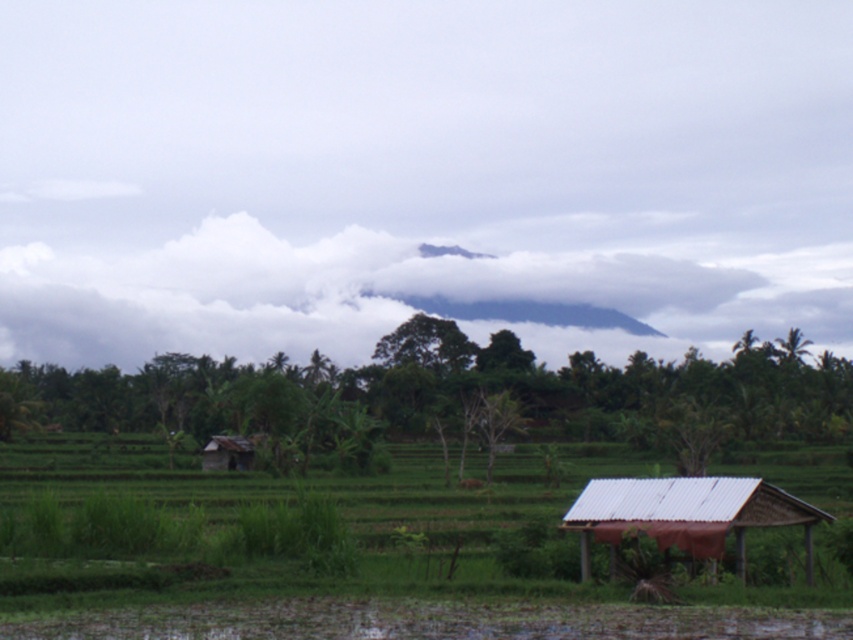
You are a drone operator planning to fly a drone with a maximum flight range of 1000 feet. You are standing at the viewer position and want to fly the drone to the white fluffy cloud at upper center. Can the drone reach the cloud?

The white fluffy cloud at upper center and viewer are 915.72 feet apart from each other. Since the drone has a maximum flight range of 1000 feet, the drone can reach the white fluffy cloud at upper center because the distance is within its range.